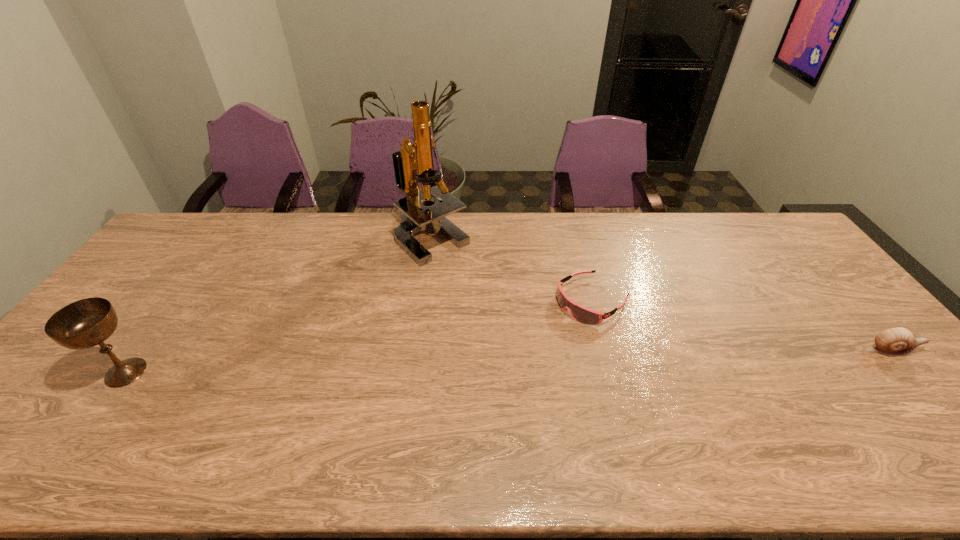
In order to click on free point at the far edge in this screenshot , I will do `click(232, 219)`.

Locate an element on the screen. The image size is (960, 540). vacant space at the near edge of the desktop is located at coordinates tap(764, 420).

Identify the location of free space at the left edge of the desktop. Image resolution: width=960 pixels, height=540 pixels. (171, 278).

This screenshot has height=540, width=960. What are the coordinates of `vacant region at the right edge` in the screenshot? It's located at [837, 308].

Locate an element on the screen. free space at the far left corner is located at coordinates 176,245.

I want to click on free spot at the near left corner of the desktop, so click(x=76, y=425).

Identify the location of free space between the second shortest object and the second object from left to right. (661, 294).

I want to click on vacant space in between the tallest object and the third nearest object, so click(x=512, y=269).

At what (x,y) coordinates should I click in order to perform the action: click on vacant area that lies between the rightmost object and the microscope. Please return your answer as a coordinate pair (x, y). The height and width of the screenshot is (540, 960). Looking at the image, I should click on click(x=661, y=294).

Where is `vacant area between the second tallest object and the escargot`? This screenshot has width=960, height=540. vacant area between the second tallest object and the escargot is located at coordinates click(509, 361).